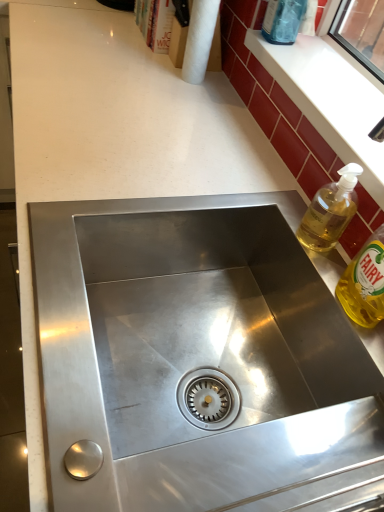
Question: From the image's perspective, is yellow translucent liquid at right, the 1th bottle viewed from the front, beneath white glossy window sill at upper right?

Choices:
 (A) yes
 (B) no

Answer: (A)

Question: Is yellow translucent liquid at right, the 1th bottle viewed from the front, not close to white glossy window sill at upper right?

Choices:
 (A) no
 (B) yes

Answer: (A)

Question: Is yellow translucent liquid at right, the first bottle in the bottom-to-top sequence, outside white glossy window sill at upper right?

Choices:
 (A) no
 (B) yes

Answer: (B)

Question: Does yellow translucent liquid at right, the first bottle in the bottom-to-top sequence, appear on the right side of white glossy window sill at upper right?

Choices:
 (A) yes
 (B) no

Answer: (B)

Question: Are yellow translucent liquid at right, the 3th bottle positioned from the back, and white glossy window sill at upper right beside each other?

Choices:
 (A) no
 (B) yes

Answer: (A)

Question: From their relative heights in the image, would you say translucent yellow liquid at upper right, which is the 2th bottle from bottom to top, is taller or shorter than white paper towel at upper center?

Choices:
 (A) tall
 (B) short

Answer: (B)

Question: From the image's perspective, is translucent yellow liquid at upper right, the second bottle when ordered from top to bottom, above or below white paper towel at upper center?

Choices:
 (A) above
 (B) below

Answer: (B)

Question: Looking at the image, does translucent yellow liquid at upper right, the second bottle when ordered from top to bottom, seem bigger or smaller compared to white paper towel at upper center?

Choices:
 (A) big
 (B) small

Answer: (B)

Question: Considering their positions, is translucent yellow liquid at upper right, the second bottle when ordered from top to bottom, located in front of or behind white paper towel at upper center?

Choices:
 (A) behind
 (B) front

Answer: (B)

Question: Is translucent yellow liquid at upper right, which is the 2th bottle in front-to-back order, to the left or to the right of transparent glass bottle at upper right, the third bottle in the front-to-back sequence, in the image?

Choices:
 (A) right
 (B) left

Answer: (A)

Question: From the image's perspective, is translucent yellow liquid at upper right, the 2th bottle when ordered from back to front, above or below transparent glass bottle at upper right, the 1th bottle when ordered from top to bottom?

Choices:
 (A) above
 (B) below

Answer: (B)

Question: Considering their positions, is translucent yellow liquid at upper right, the second bottle when ordered from top to bottom, located in front of or behind transparent glass bottle at upper right, positioned as the first bottle in back-to-front order?

Choices:
 (A) behind
 (B) front

Answer: (B)

Question: From their relative heights in the image, would you say translucent yellow liquid at upper right, the second bottle when ordered from top to bottom, is taller or shorter than transparent glass bottle at upper right, the 3th bottle in the bottom-to-top sequence?

Choices:
 (A) short
 (B) tall

Answer: (A)

Question: From a real-world perspective, relative to translucent yellow liquid at upper right, the second bottle when ordered from top to bottom, is transparent glass bottle at upper right, the 3th bottle in the bottom-to-top sequence, vertically above or below?

Choices:
 (A) above
 (B) below

Answer: (A)

Question: Would you say transparent glass bottle at upper right, positioned as the first bottle in back-to-front order, is inside or outside translucent yellow liquid at upper right, which is the 2th bottle in front-to-back order?

Choices:
 (A) outside
 (B) inside

Answer: (A)